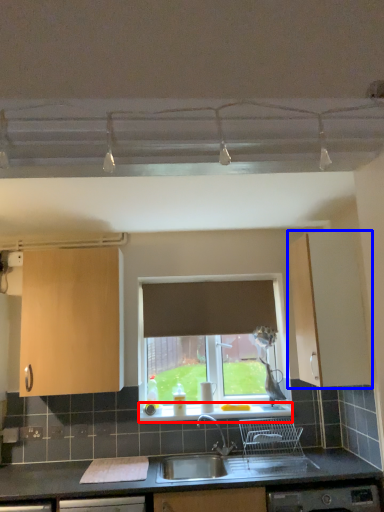
Question: Which object appears farthest to the camera in this image, window sill (highlighted by a red box) or cabinetry (highlighted by a blue box)?

Choices:
 (A) window sill
 (B) cabinetry

Answer: (A)